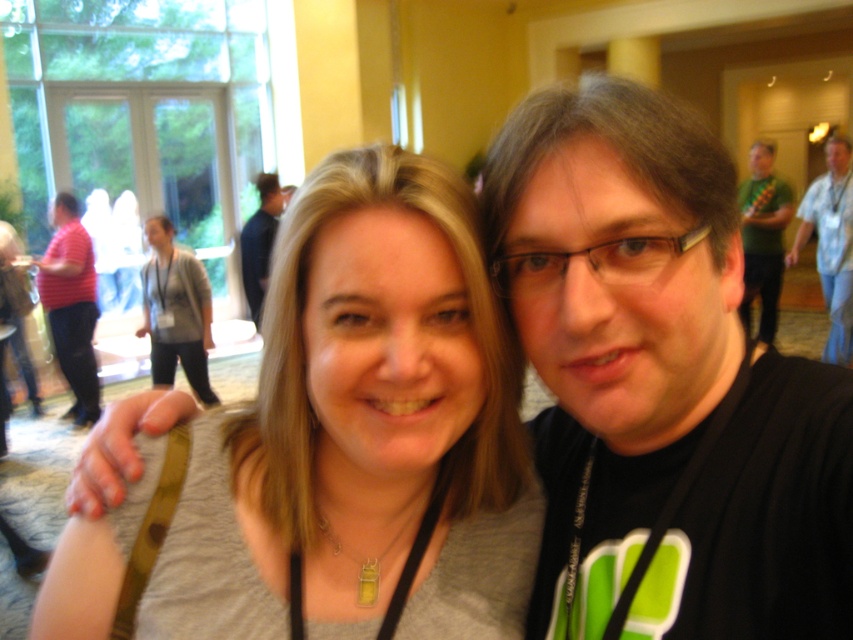
Does point (78, 227) come closer to viewer compared to point (260, 179)?

That is True.

Who is lower down, matte red shirt at left or blue shirt at upper left?

matte red shirt at left is below.

Which is in front, point (86, 346) or point (270, 234)?

Positioned in front is point (86, 346).

Locate an element on the screen. matte red shirt at left is located at coordinates (71, 305).

Is gray fabric shirt at center positioned at the back of blue striped shirt at upper right?

No, it is in front of blue striped shirt at upper right.

At what (x,y) coordinates should I click in order to perform the action: click on gray fabric shirt at center. Please return your answer as a coordinate pair (x, y). Looking at the image, I should click on (339, 444).

Can you confirm if gray fabric shirt at center is wider than black matte shirt at center?

Yes.

Which is below, gray fabric shirt at center or black matte shirt at center?

gray fabric shirt at center is lower down.

Between point (305, 426) and point (834, 547), which one is positioned in front?

Point (834, 547)

Image resolution: width=853 pixels, height=640 pixels. I want to click on gray fabric shirt at center, so click(x=339, y=444).